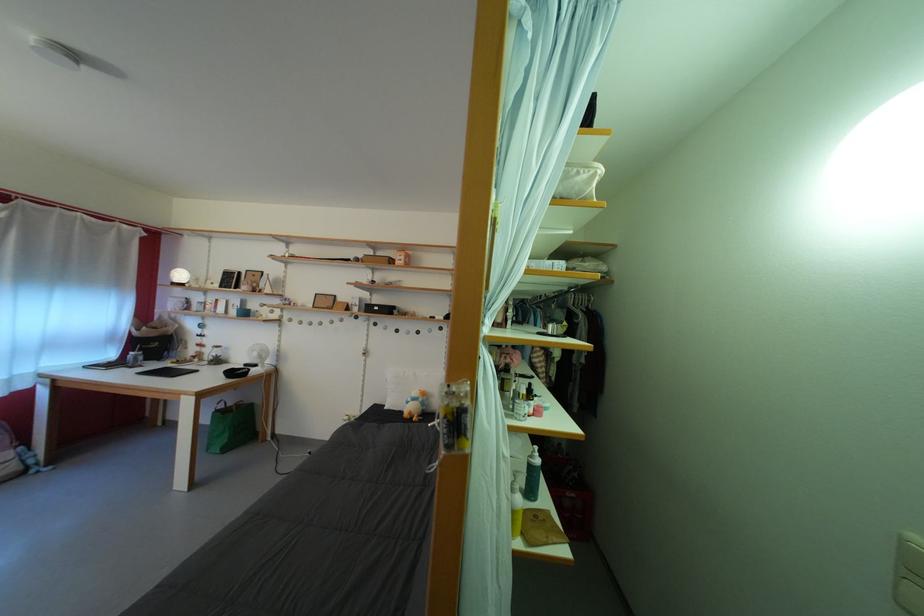
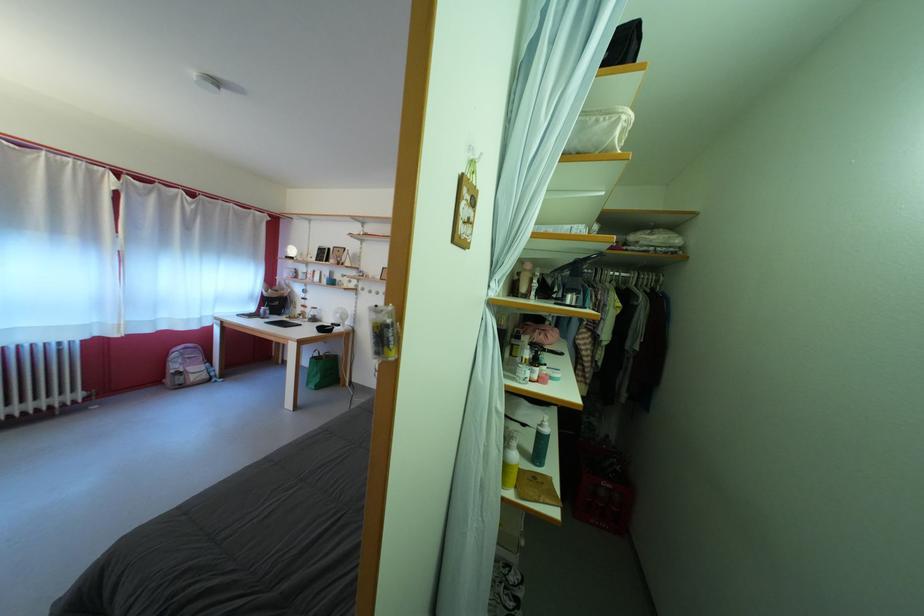
The point at (457,428) is marked in the first image. Where is the corresponding point in the second image?

(383, 339)